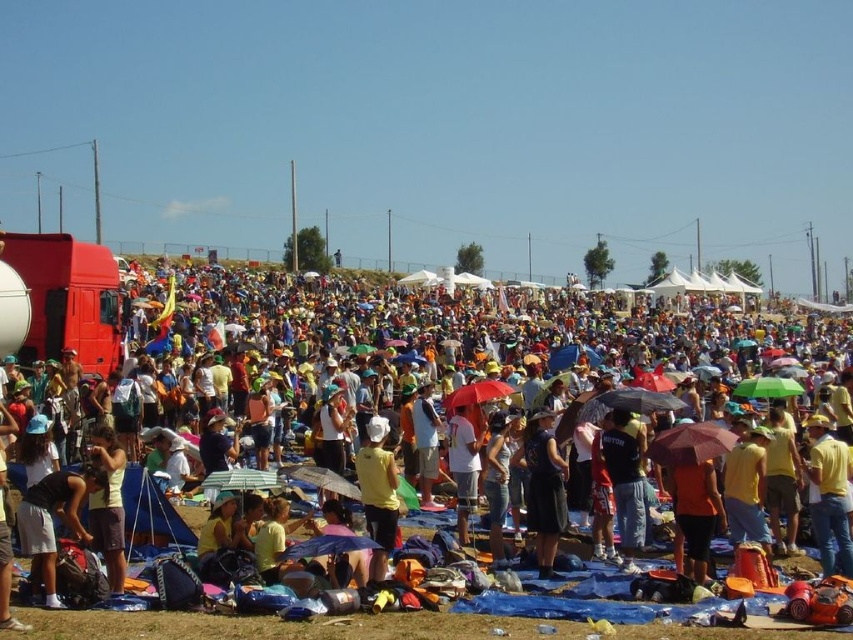
Question: Which point is farther to the camera?

Choices:
 (A) black dress at center
 (B) yellow fabric umbrella at center
 (C) maroon fabric umbrella at center
 (D) blue fabric umbrella at center

Answer: (A)

Question: Can you confirm if black dress at center is positioned above red matte umbrella at center?

Choices:
 (A) no
 (B) yes

Answer: (A)

Question: Among these objects, which one is farthest from the camera?

Choices:
 (A) black dress at center
 (B) green matte umbrella at center
 (C) yellow fabric umbrella at center
 (D) blue fabric umbrella at center

Answer: (B)

Question: Is yellow matte shirt at center below blue fabric umbrella at center?

Choices:
 (A) no
 (B) yes

Answer: (A)

Question: Which point is closer to the camera?

Choices:
 (A) (357, 545)
 (B) (672, 429)

Answer: (A)

Question: Can you confirm if blue fabric umbrella at center is thinner than red matte umbrella at center?

Choices:
 (A) no
 (B) yes

Answer: (A)